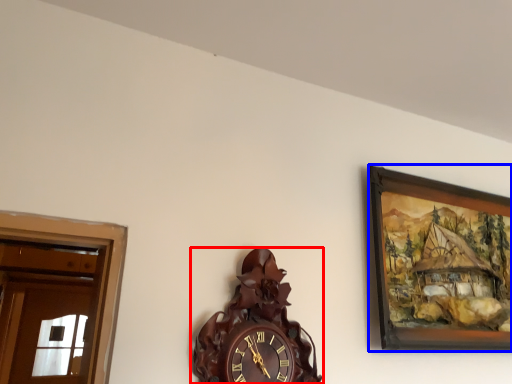
Question: Among these objects, which one is farthest to the camera, wall clock (highlighted by a red box) or picture frame (highlighted by a blue box)?

Choices:
 (A) wall clock
 (B) picture frame

Answer: (B)